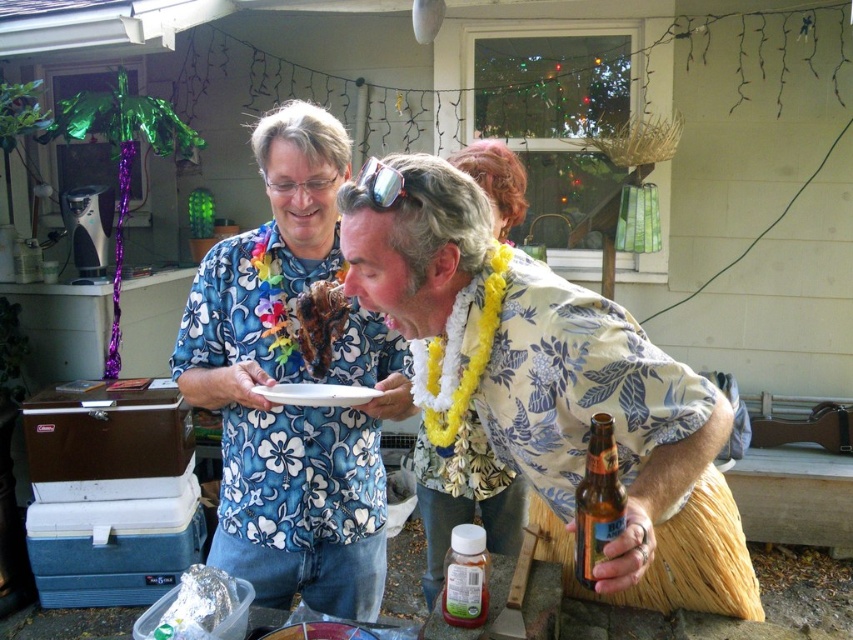
You are at a party and want to greet the person wearing the blue floral shirt at center. Which direction should you walk from the white fabric lei at center to reach them?

The blue floral shirt at center is to the left of the white fabric lei at center, so you should walk to the left from the white fabric lei at center to reach them.

You are at a party and want to know which item is taller between the floral fabric shirt at center and the white fabric lei at center. Which one is taller?

The floral fabric shirt at center has a greater height compared to the white fabric lei at center, so the floral fabric shirt at center is taller.

You are standing at the edge of the porch where the outdoor gathering is happening. You want to locate the floral fabric shirt at center. Which direction should you look to find it?

The floral fabric shirt at center is located at point 0.609 on the x axis and 0.635 on the y axis, so you should look towards the center of the image to find it.